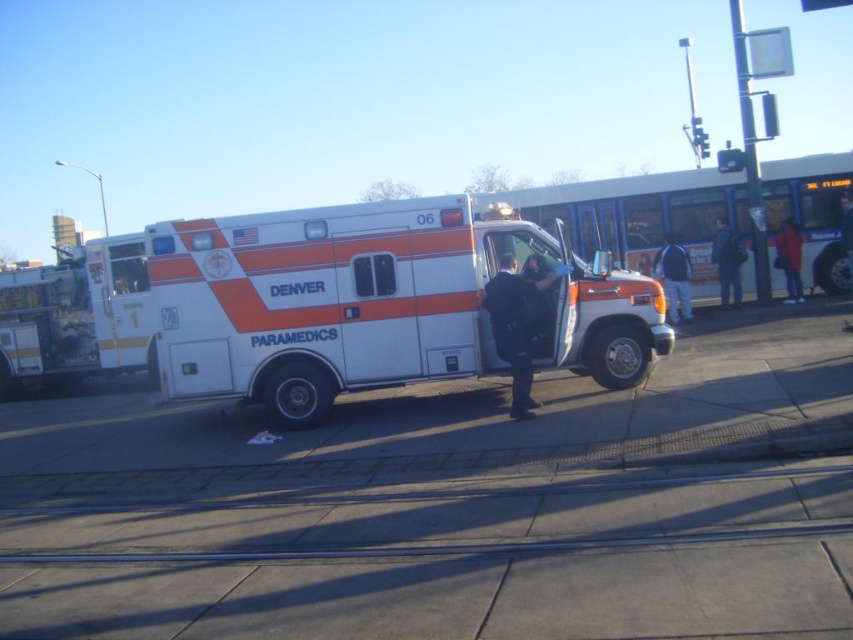
The image size is (853, 640). What do you see at coordinates (515, 326) in the screenshot?
I see `black leather jacket at center` at bounding box center [515, 326].

Does point (511, 257) come closer to viewer compared to point (724, 228)?

Yes, it is.

This screenshot has width=853, height=640. Find the location of `black leather jacket at center`. black leather jacket at center is located at coordinates (515, 326).

Can you confirm if dark blue jacket at center is bigger than dark blue jacket at right?

Indeed, dark blue jacket at center has a larger size compared to dark blue jacket at right.

Between dark blue jacket at center and dark blue jacket at right, which one appears on the right side from the viewer's perspective?

Positioned to the right is dark blue jacket at right.

Locate an element on the screen. Image resolution: width=853 pixels, height=640 pixels. dark blue jacket at center is located at coordinates (674, 280).

Identify the location of dark blue jacket at center. This screenshot has width=853, height=640. (674, 280).

Is point (735, 264) positioned behind point (798, 234)?

No, it is not.

Between dark blue jacket at right and red fabric jacket at right, which one has less height?

red fabric jacket at right is shorter.

Does point (720, 289) come in front of point (779, 244)?

No, (720, 289) is further to viewer.

At what (x,y) coordinates should I click in order to perform the action: click on dark blue jacket at right. Please return your answer as a coordinate pair (x, y). Looking at the image, I should click on (727, 260).